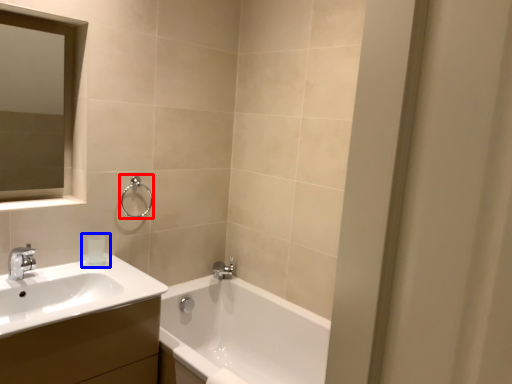
Question: Which object appears farthest to the camera in this image, shower (highlighted by a red box) or toiletry (highlighted by a blue box)?

Choices:
 (A) shower
 (B) toiletry

Answer: (A)